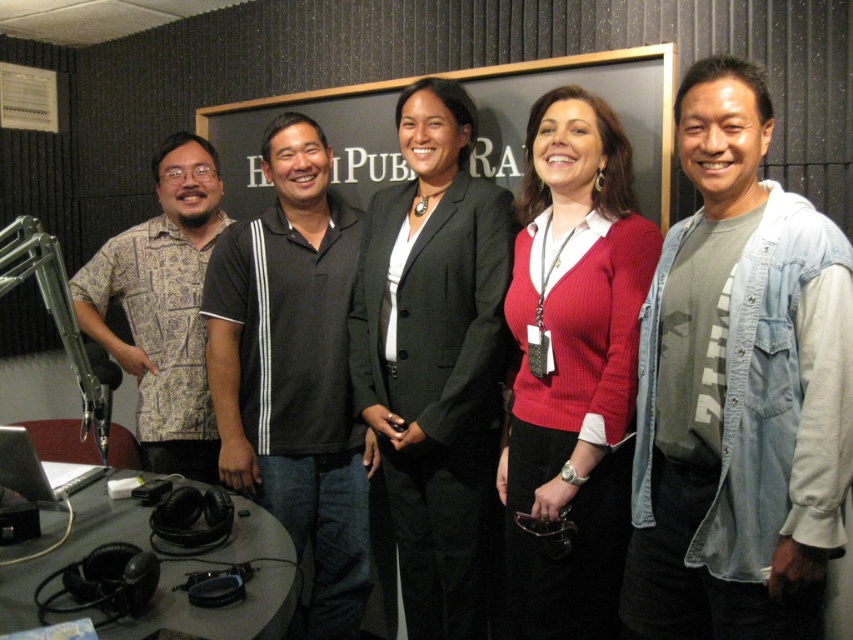
You are a photographer setting up for a group photo in the radio studio. You need to position the blackboard at center and the patterned fabric shirt at left so that they are both visible in the frame. Considering their sizes, which object should you place closer to the camera to ensure both fit within the shot?

The blackboard at center is wider than the patterned fabric shirt at left, so to ensure both fit in the frame, you should place the blackboard at center closer to the camera. This adjustment accounts for its larger size, maintaining visibility for both objects.